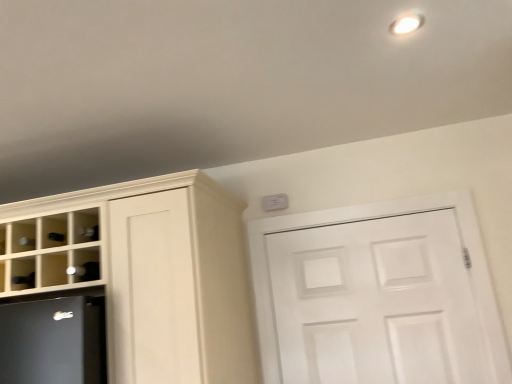
I want to click on white matte door at upper center, so click(x=376, y=302).

Describe the element at coordinates (376, 302) in the screenshot. I see `white matte door at upper center` at that location.

I want to click on white matte door at upper center, so click(376, 302).